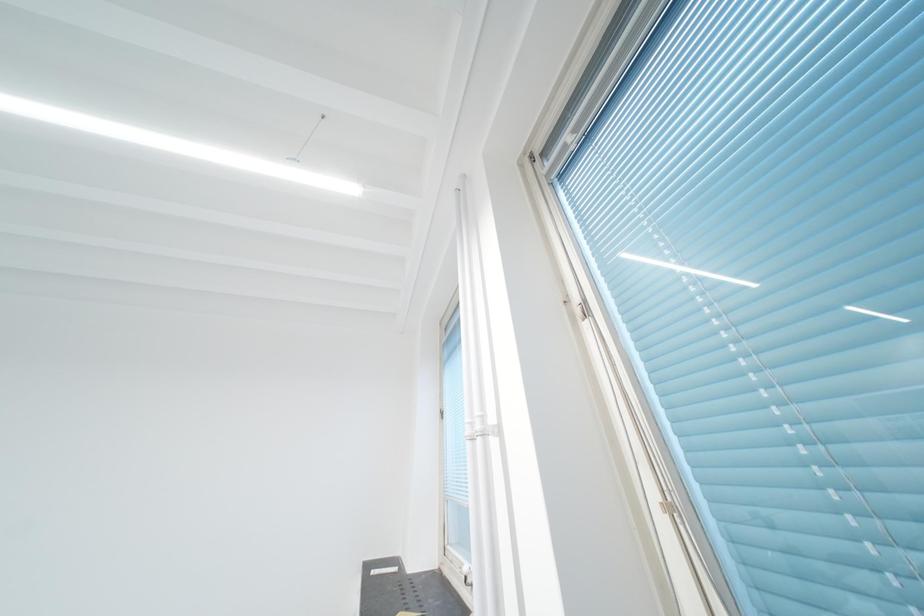
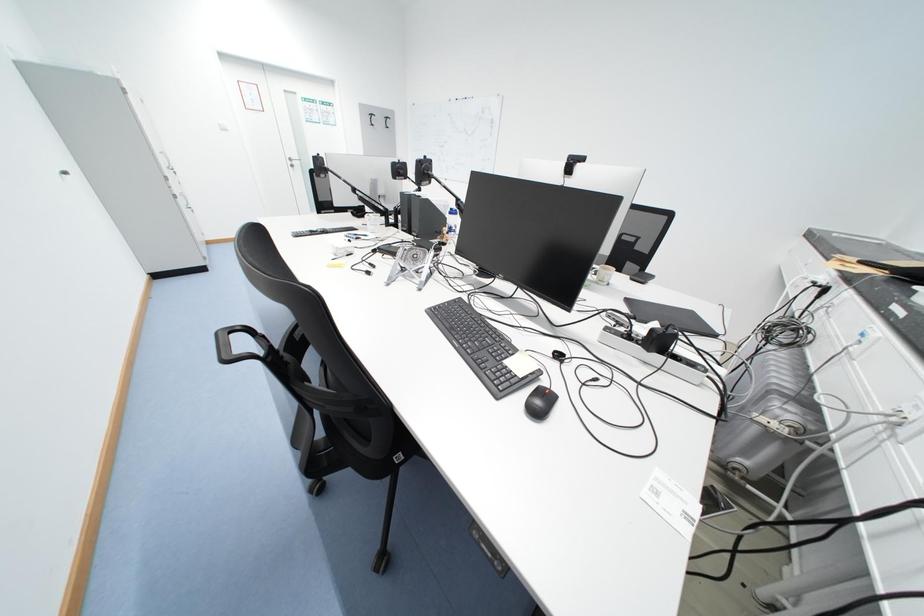
The first image is from the beginning of the video and the second image is from the end. How did the camera likely rotate when shooting the video?

The rotation direction of the camera is left-down.